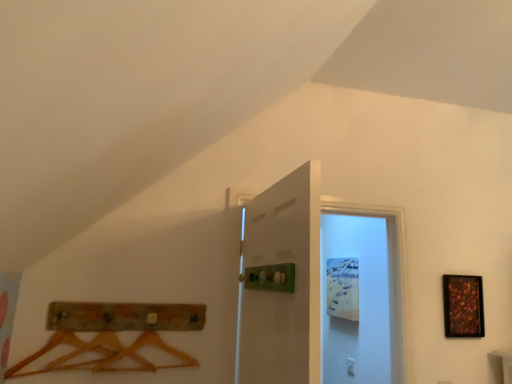
Question: Which direction should I rotate to look at white matte door at center, which is the first door from back to front?

Choices:
 (A) left
 (B) right

Answer: (B)

Question: Does white matte door at center, the 1th door from the front, appear on the left side of shiny metallic picture frame at right?

Choices:
 (A) yes
 (B) no

Answer: (A)

Question: Could shiny metallic picture frame at right be considered to be inside white matte door at center, the 1th door from the front?

Choices:
 (A) yes
 (B) no

Answer: (B)

Question: Is white matte door at center, positioned as the 2th door in back-to-front order, outside shiny metallic picture frame at right?

Choices:
 (A) yes
 (B) no

Answer: (A)

Question: Is white matte door at center, the 1th door from the front, looking in the opposite direction of shiny metallic picture frame at right?

Choices:
 (A) no
 (B) yes

Answer: (A)

Question: From a real-world perspective, is white matte door at center, the 1th door from the front, located higher than shiny metallic picture frame at right?

Choices:
 (A) no
 (B) yes

Answer: (B)

Question: Does white matte door at center, the 1th door from the front, lie behind shiny metallic picture frame at right?

Choices:
 (A) no
 (B) yes

Answer: (A)

Question: Is white matte door at center, which is the first door from back to front, positioned far away from shiny metallic picture frame at right?

Choices:
 (A) no
 (B) yes

Answer: (A)

Question: From a real-world perspective, is white matte door at center, arranged as the second door when viewed from the front, on top of shiny metallic picture frame at right?

Choices:
 (A) no
 (B) yes

Answer: (B)

Question: Is the depth of white matte door at center, which is the first door from back to front, less than that of shiny metallic picture frame at right?

Choices:
 (A) yes
 (B) no

Answer: (A)

Question: Is white matte door at center, which is the first door from back to front, smaller than shiny metallic picture frame at right?

Choices:
 (A) yes
 (B) no

Answer: (B)

Question: Considering the relative sizes of white matte door at center, arranged as the second door when viewed from the front, and shiny metallic picture frame at right in the image provided, is white matte door at center, arranged as the second door when viewed from the front, bigger than shiny metallic picture frame at right?

Choices:
 (A) no
 (B) yes

Answer: (B)

Question: Is white matte door at center, which is the first door from back to front, not inside shiny metallic picture frame at right?

Choices:
 (A) yes
 (B) no

Answer: (A)

Question: Would you say white matte door at center, arranged as the second door when viewed from the front, is outside white matte door at center, positioned as the 2th door in back-to-front order?

Choices:
 (A) no
 (B) yes

Answer: (B)